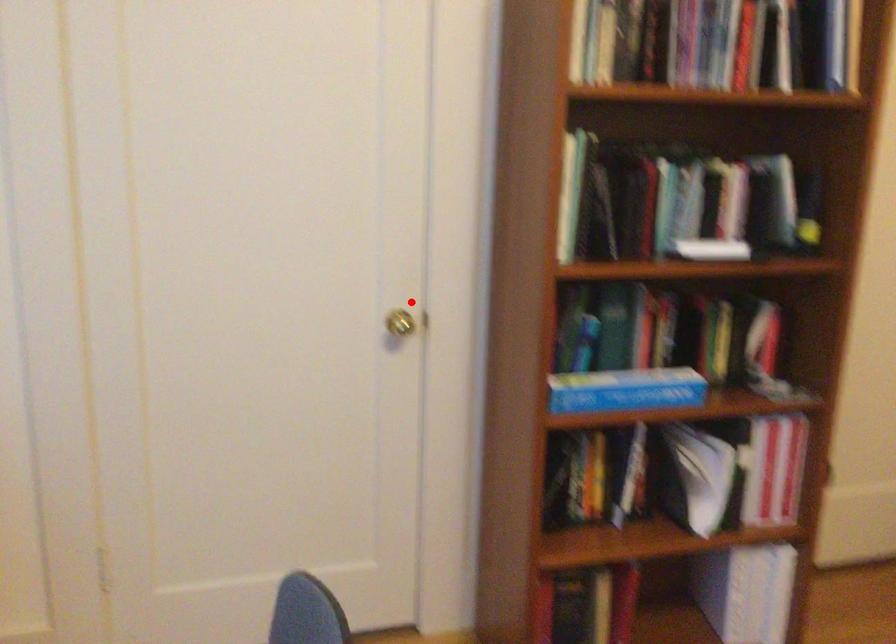
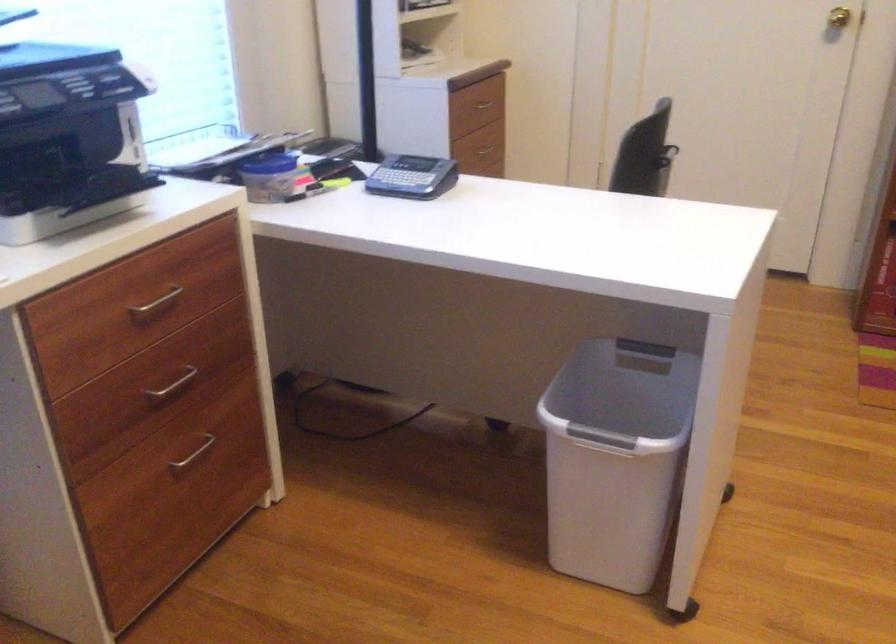
Question: A red point is marked in image1. In image2, is the corresponding 3D point closer to the camera or farther? Reply with the corresponding letter.

Choices:
 (A) The corresponding 3D point is closer.
 (B) The corresponding 3D point is farther.

Answer: (B)